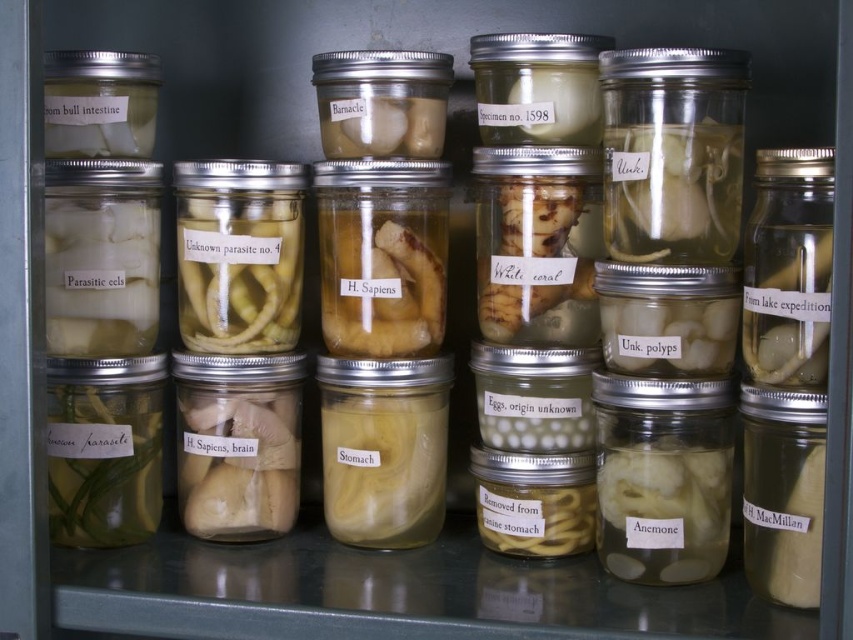
You are a researcher in the lab looking at the jars. You need to retrieve a jar located at point A and point B. Point A is at coordinates point (257, 465) and point B is at point (637, 320). Which point is closer to you?

Point A at coordinates point (257, 465) is closer to you than point B at point (637, 320) because it is further to the viewer according to the description.

You are a researcher in a lab looking at the jars. You need to retrieve the white soft brain at center and the translucent gelatinous polyps at center. Which jar is located to the left of the other?

The white soft brain at center is to the left of the translucent gelatinous polyps at center.